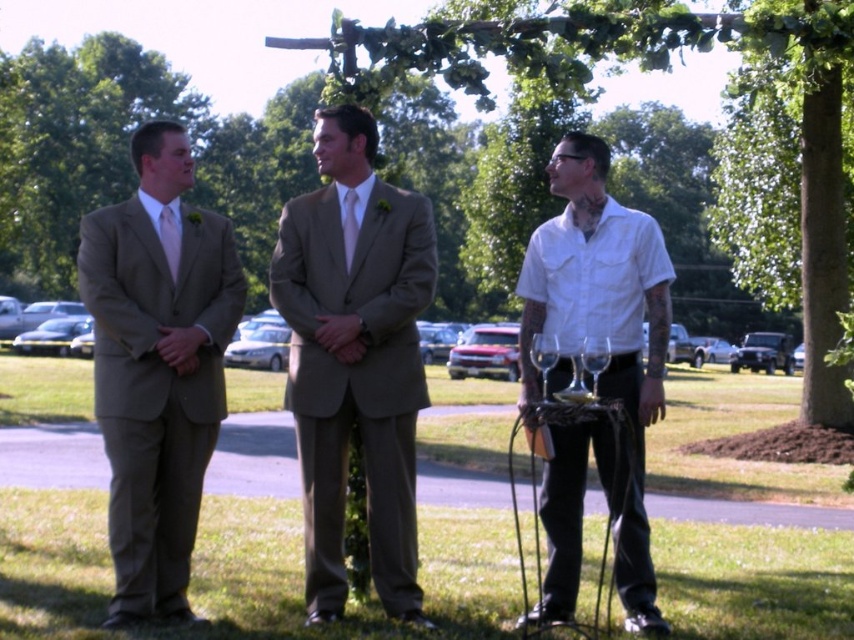
Is point (288, 381) in front of point (162, 236)?

No, it is not.

Does point (399, 380) come farther from viewer compared to point (167, 259)?

No, it is not.

At what (x,y) coordinates should I click in order to perform the action: click on matte brown suit at center. Please return your answer as a coordinate pair (x, y). The height and width of the screenshot is (640, 854). Looking at the image, I should click on (355, 360).

Is matte brown suit at left wider than matte white tie at center?

Yes.

Locate an element on the screen. This screenshot has height=640, width=854. matte brown suit at left is located at coordinates (156, 369).

Does matte brown suit at center appear over white matte shirt at center?

Yes, matte brown suit at center is above white matte shirt at center.

Is matte brown suit at center further to the viewer compared to white matte shirt at center?

That is True.

Does point (282, 278) come in front of point (600, 305)?

No, it is behind (600, 305).

At what (x,y) coordinates should I click in order to perform the action: click on matte brown suit at center. Please return your answer as a coordinate pair (x, y). Looking at the image, I should click on (355, 360).